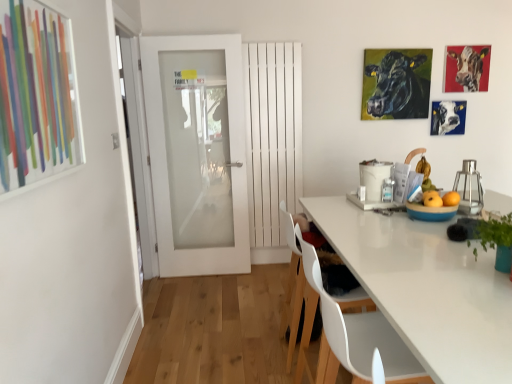
The height and width of the screenshot is (384, 512). What are the coordinates of `free spot above black glossy cattle at upper right, the 1th cattle from the left (from a real-world perspective)` in the screenshot? It's located at (395, 46).